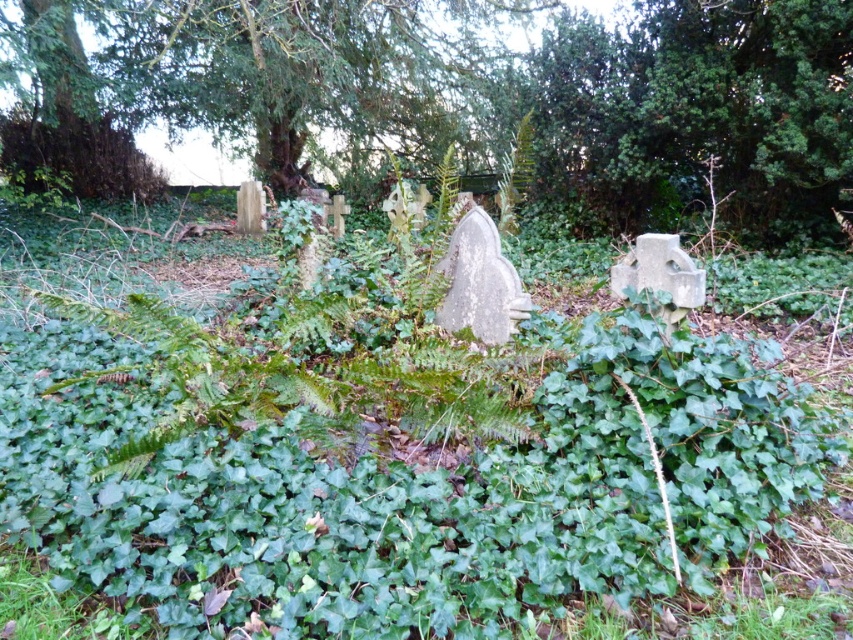
Question: Which point is farther to the camera?

Choices:
 (A) green leafy bush at upper left
 (B) green leafy tree at upper center

Answer: (A)

Question: Does green leafy tree at upper center appear under green leafy bush at upper left?

Choices:
 (A) no
 (B) yes

Answer: (A)

Question: Observing the image, what is the correct spatial positioning of green leafy tree at upper center in reference to green leafy bush at upper left?

Choices:
 (A) left
 (B) right

Answer: (B)

Question: From the image, what is the correct spatial relationship of green leafy tree at upper center in relation to green leafy bush at upper left?

Choices:
 (A) below
 (B) above

Answer: (B)